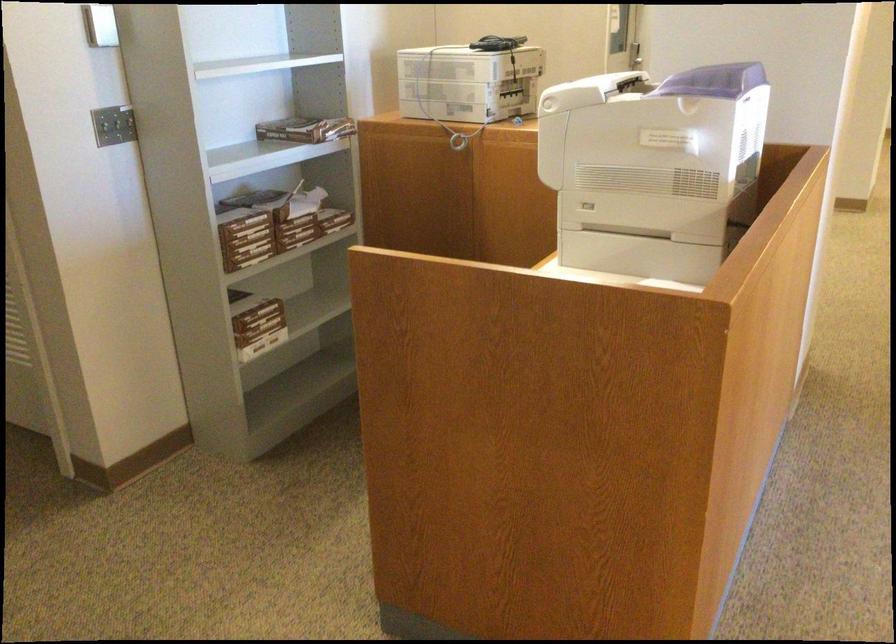
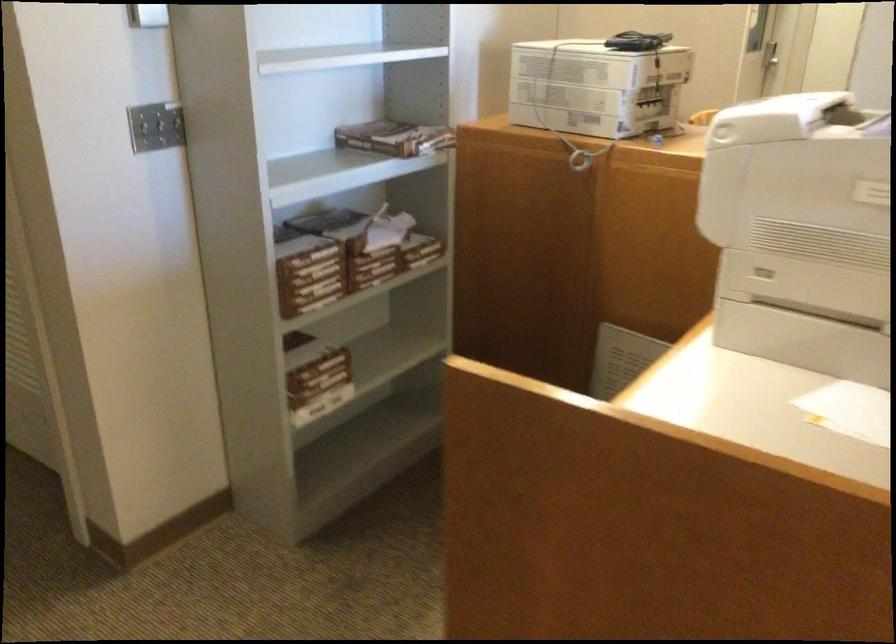
What movement of the cameraman would produce the second image?

The cameraman moved toward left, forward.